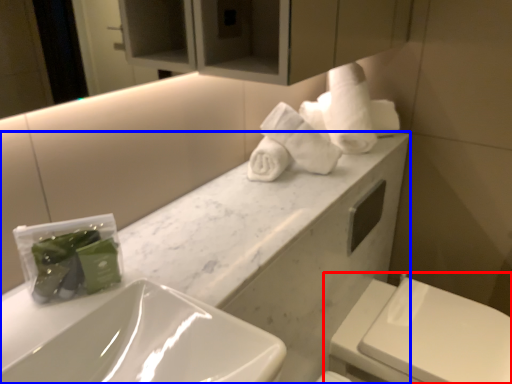
Question: Which object is closer to the camera taking this photo, toilet (highlighted by a red box) or porcelain (highlighted by a blue box)?

Choices:
 (A) toilet
 (B) porcelain

Answer: (B)